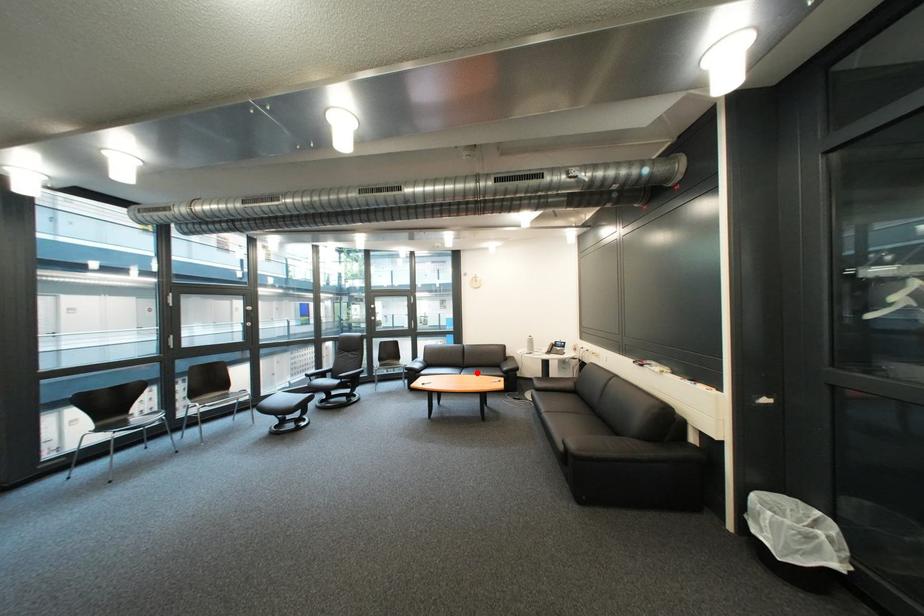
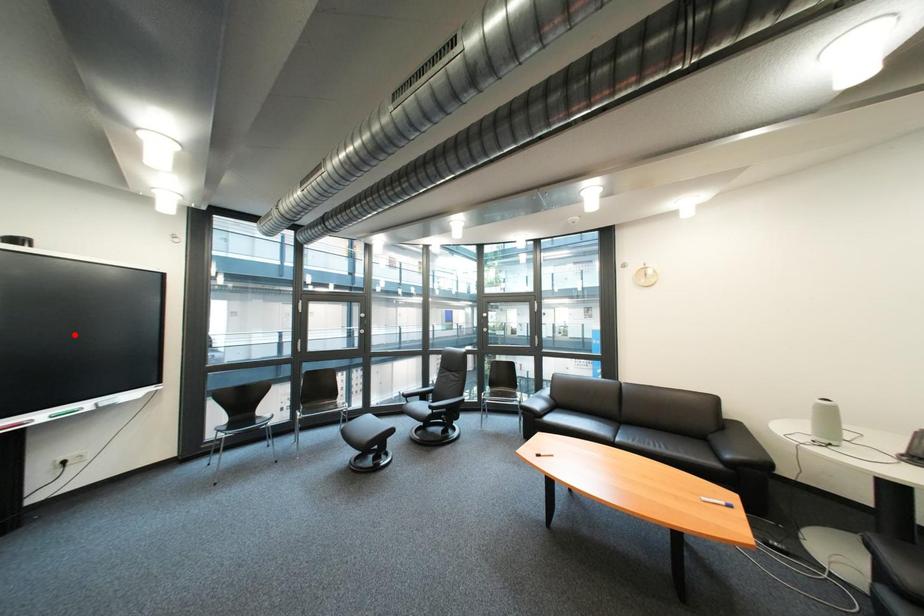
I am providing you with two images of the same scene from different viewpoints. A red point is marked on the first image and another point is marked on the second image. Are the points marked in image1 and image2 representing the same 3D position?

No